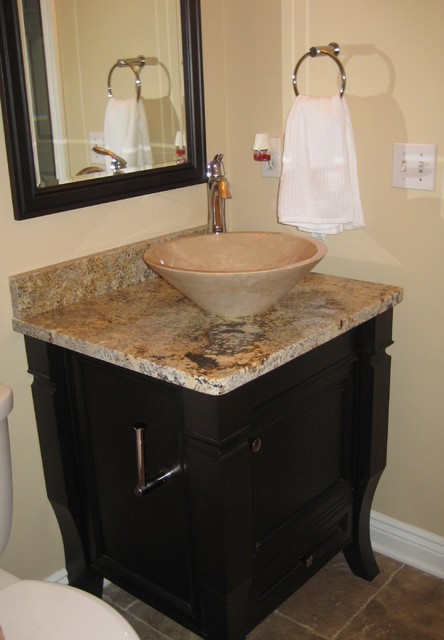
Find the location of a particular element. This screenshot has width=444, height=640. bowl is located at coordinates (215, 294).